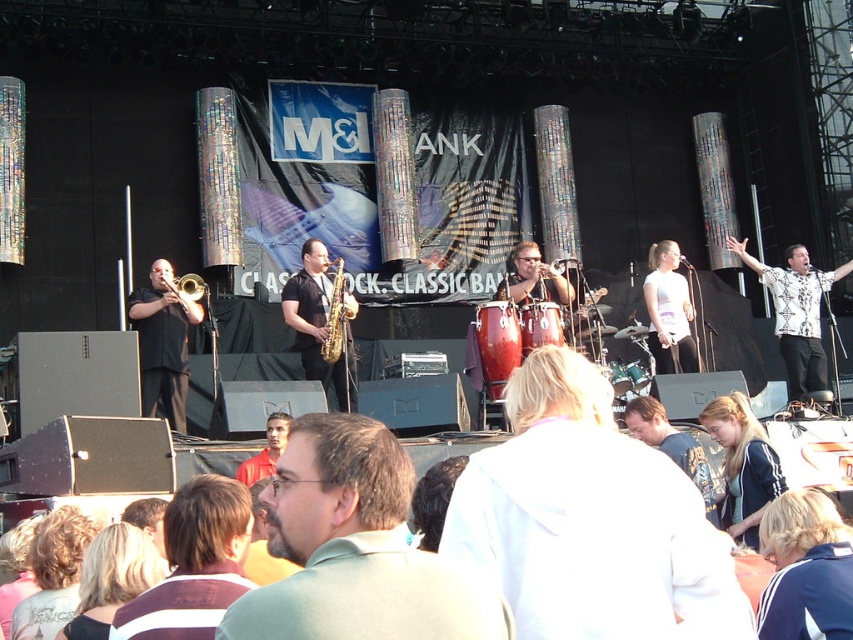
Between white cotton hoodie at center and matte gold trumpet at center, which one appears on the right side from the viewer's perspective?

From the viewer's perspective, matte gold trumpet at center appears more on the right side.

Which is below, white cotton hoodie at center or matte gold trumpet at center?

white cotton hoodie at center is below.

The height and width of the screenshot is (640, 853). In order to click on white cotton hoodie at center in this screenshot , I will do `click(589, 520)`.

Which is more to the left, matte gold trumpet at left or satin gold saxophone at center?

Positioned to the left is matte gold trumpet at left.

Who is taller, matte gold trumpet at left or satin gold saxophone at center?

With more height is satin gold saxophone at center.

Between point (186, 301) and point (341, 284), which one is positioned in front?

Point (186, 301)

Locate an element on the screen. Image resolution: width=853 pixels, height=640 pixels. matte gold trumpet at left is located at coordinates (x=163, y=342).

Can you confirm if blonde hair at center is wider than red shirt at center?

Yes.

Does blonde hair at center appear over red shirt at center?

No.

What do you see at coordinates (54, 572) in the screenshot? I see `blonde hair at center` at bounding box center [54, 572].

Find the location of a particular element. The image size is (853, 640). blonde hair at center is located at coordinates (54, 572).